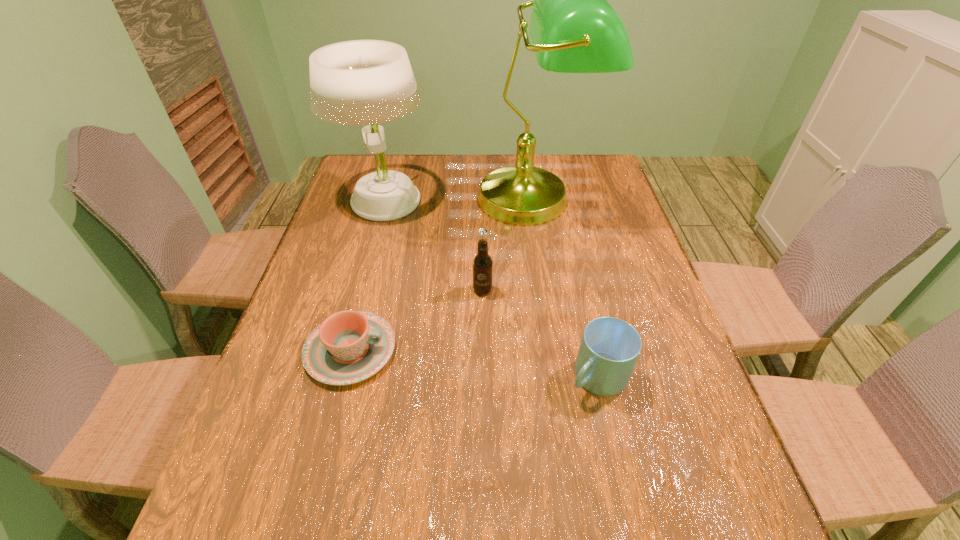
Find the location of a particular element. vacant space situated 0.070m on the label of the third nearest object is located at coordinates (483, 318).

The width and height of the screenshot is (960, 540). I want to click on free space located on the back of the fourth tallest object, so click(x=587, y=329).

Where is `vacant position located 0.060m on the handle side of the shortest object`? This screenshot has width=960, height=540. vacant position located 0.060m on the handle side of the shortest object is located at coordinates (422, 350).

Find the location of a particular element. The height and width of the screenshot is (540, 960). lamp located at the left edge is located at coordinates (360, 82).

Identify the location of chinaware located in the left edge section of the desktop. Image resolution: width=960 pixels, height=540 pixels. (348, 347).

Find the location of `lamp that is at the right edge`. lamp that is at the right edge is located at coordinates (573, 29).

Find the location of a particular element. The height and width of the screenshot is (540, 960). mug that is at the right edge is located at coordinates (609, 349).

You are a GUI agent. You are given a task and a screenshot of the screen. Output one action in this format:
    pyautogui.click(x=<x>, y=<y>)
    Task: Click on the object present at the far left corner
    The width and height of the screenshot is (960, 540).
    Given the screenshot: What is the action you would take?
    pyautogui.click(x=360, y=82)

Locate an element on the screen. Image resolution: width=960 pixels, height=540 pixels. object that is at the far right corner is located at coordinates (573, 29).

The height and width of the screenshot is (540, 960). Identify the location of vacant space at the far edge of the desktop. (469, 169).